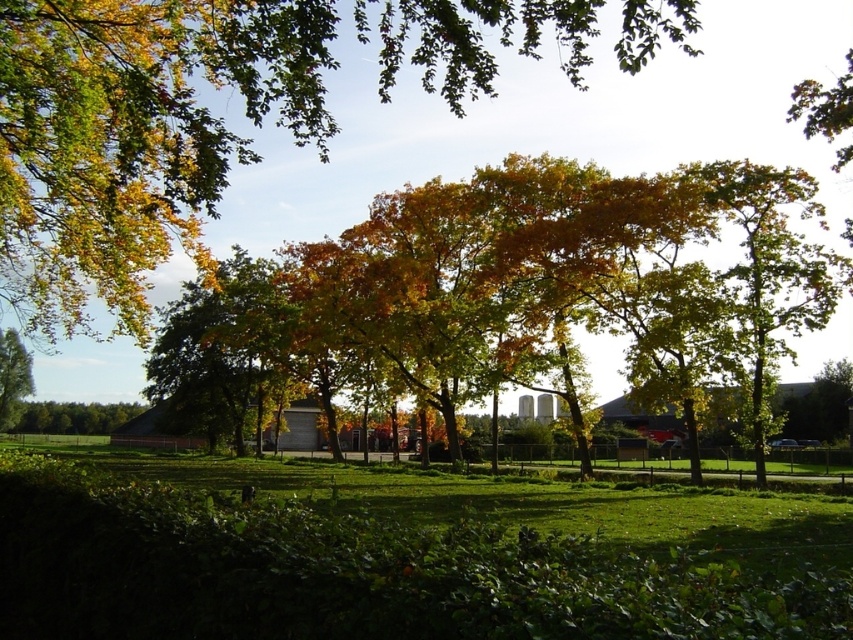
Can you confirm if green leafy park at center is smaller than green leafy tree at lower left?

Correct, green leafy park at center occupies less space than green leafy tree at lower left.

Is point (99, 550) positioned before point (35, 420)?

Yes, it is in front of point (35, 420).

Who is more forward, (22, 605) or (48, 432)?

Point (22, 605) is more forward.

You are a GUI agent. You are given a task and a screenshot of the screen. Output one action in this format:
    pyautogui.click(x=<x>, y=<y>)
    Task: Click on the green leafy park at center
    The image size is (853, 640).
    Given the screenshot: What is the action you would take?
    pyautogui.click(x=352, y=573)

Looking at this image, how distant is green leafy tree at upper center from green leafy park at center?

133.64 feet

Between green leafy tree at upper center and green leafy park at center, which one appears on the right side from the viewer's perspective?

Positioned to the right is green leafy park at center.

Where is `green leafy tree at upper center`? green leafy tree at upper center is located at coordinates (135, 138).

Where is `green leafy tree at upper center`? The image size is (853, 640). green leafy tree at upper center is located at coordinates (135, 138).

Who is positioned more to the left, green leafy tree at upper center or green leafy tree at left?

green leafy tree at left

Can you confirm if green leafy tree at upper center is positioned to the left of green leafy tree at left?

In fact, green leafy tree at upper center is to the right of green leafy tree at left.

Is point (47, 170) less distant than point (26, 388)?

Yes, point (47, 170) is closer to viewer.

You are a GUI agent. You are given a task and a screenshot of the screen. Output one action in this format:
    pyautogui.click(x=<x>, y=<y>)
    Task: Click on the green leafy tree at upper center
    Image resolution: width=853 pixels, height=640 pixels.
    Given the screenshot: What is the action you would take?
    pyautogui.click(x=135, y=138)